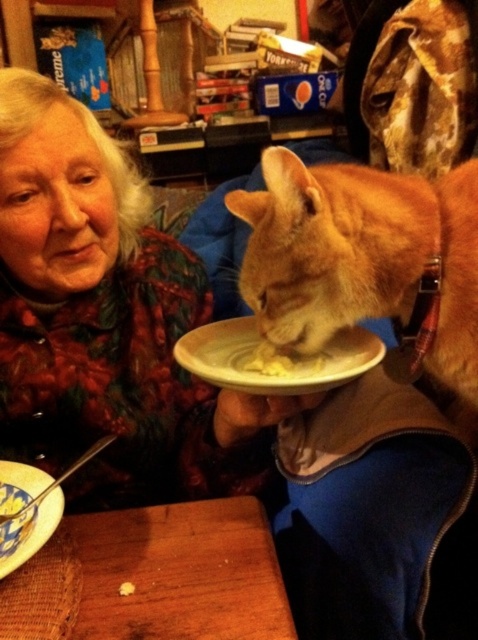
You are a cat owner who wants to serve your cat a meal. You have a blue glazed bowl at lower left and a plate with yellow creamy food at plate center. Which container should you use for the cat food?

The blue glazed bowl at lower left is bigger than the yellow creamy food at plate center, so you should use the blue glazed bowl at lower left as it can hold more food comfortably.

You have a rectangular object that is 1.2 meters in length. You want to place it on the wooden table at lower left without it hanging over the edge. Can the blue glazed bowl at lower left help you determine if the table is wide enough?

The wooden table at lower left might be wider than blue glazed bowl at lower left, so if the bowl fits comfortably on the table, there is a possibility that the table is wide enough to accommodate the 1.2 meter object without it hanging over the edge. However, since the exact dimensions of the table are not provided, this is an estimation based on the bowl being smaller than the table.

You are setting up a small table arrangement. You have a wooden table at lower left and a blue glazed bowl at lower left. Which object should you place higher to ensure the bowl is not obstructed by the table?

The wooden table at lower left is taller than the blue glazed bowl at lower left. To ensure the bowl is not obstructed by the table, you should place the blue glazed bowl at lower left higher so it sits above the table.